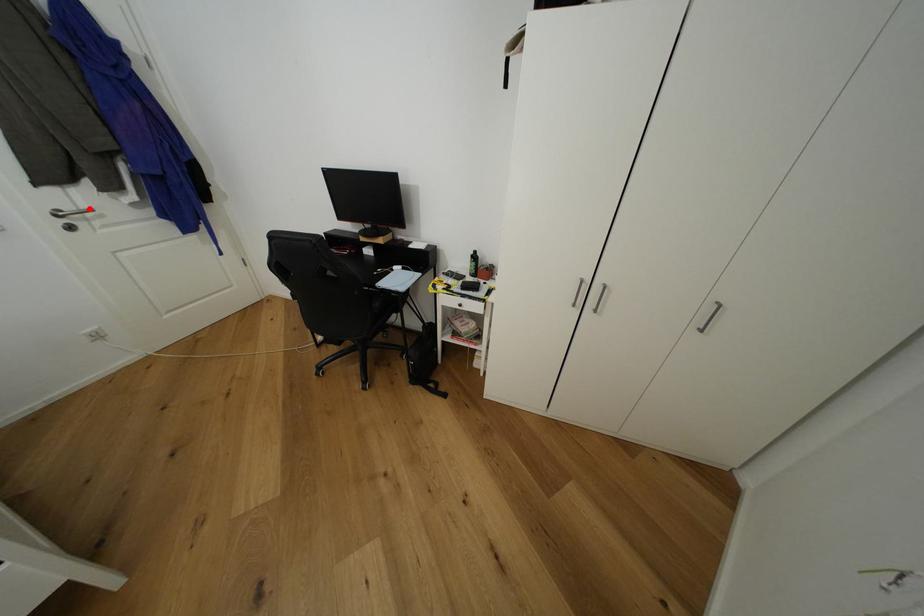
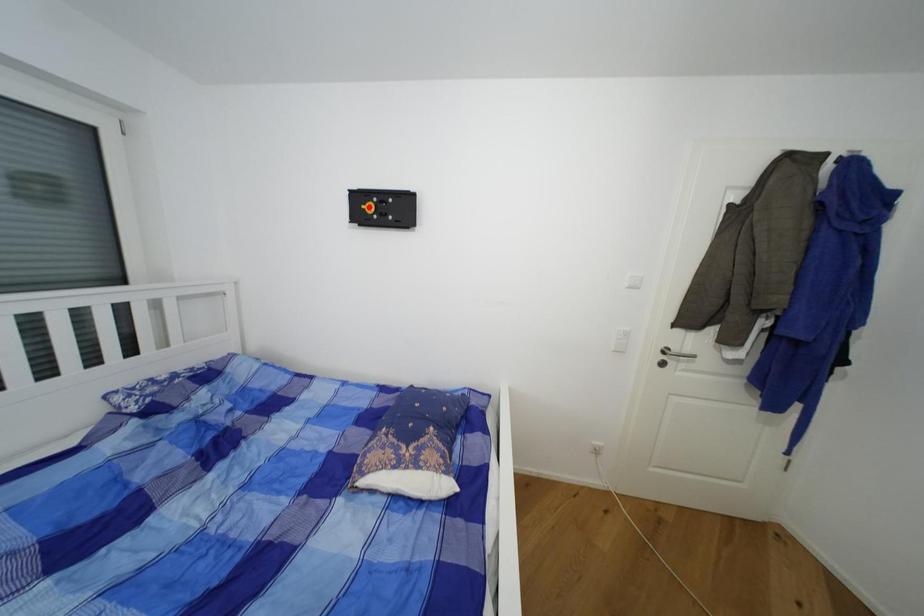
I am providing you with two images of the same scene from different viewpoints. A red point is marked on the first image and another point is marked on the second image. Does the point marked in image1 correspond to the same location as the one in image2?

No